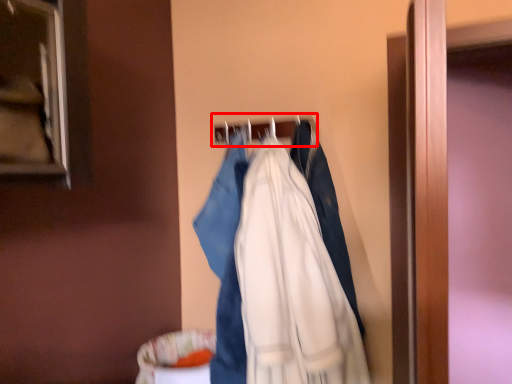
Question: From the image's perspective, what is the correct spatial positioning of hanger (annotated by the red box) in reference to fancy dress?

Choices:
 (A) below
 (B) above

Answer: (B)